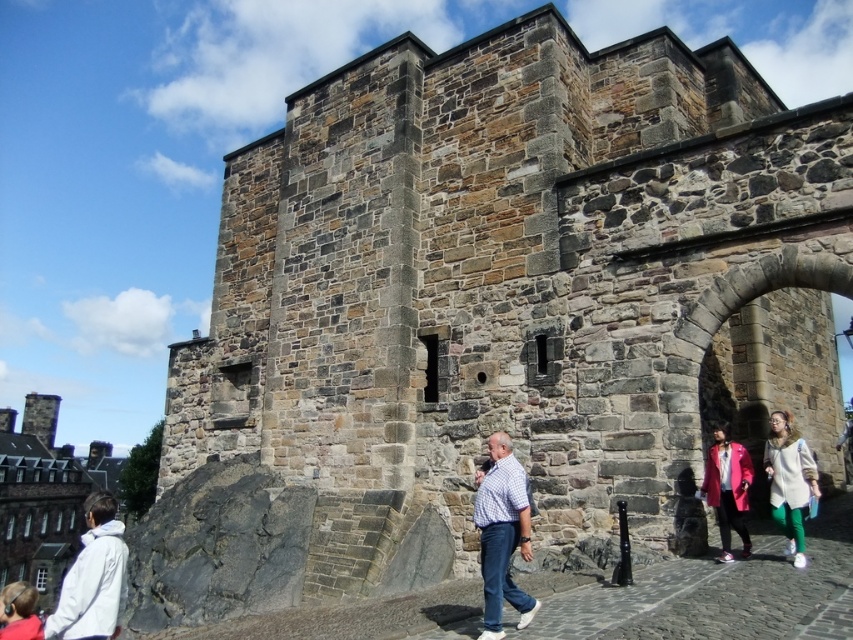
You are an artist sketching the historic stone structure. You notice two people in the scene wearing a checkered fabric shirt at center and a white fuzzy coat at lower right. Which clothing item appears shorter in your drawing?

The checkered fabric shirt at center appears shorter than the white fuzzy coat at lower right in the drawing.

You are standing in front of the historic stone structure and notice both the stone archway at center right and the checkered fabric shirt at center. Which object is closer to you?

The stone archway at center right is closer to you since it is further to the viewer than the checkered fabric shirt at center.